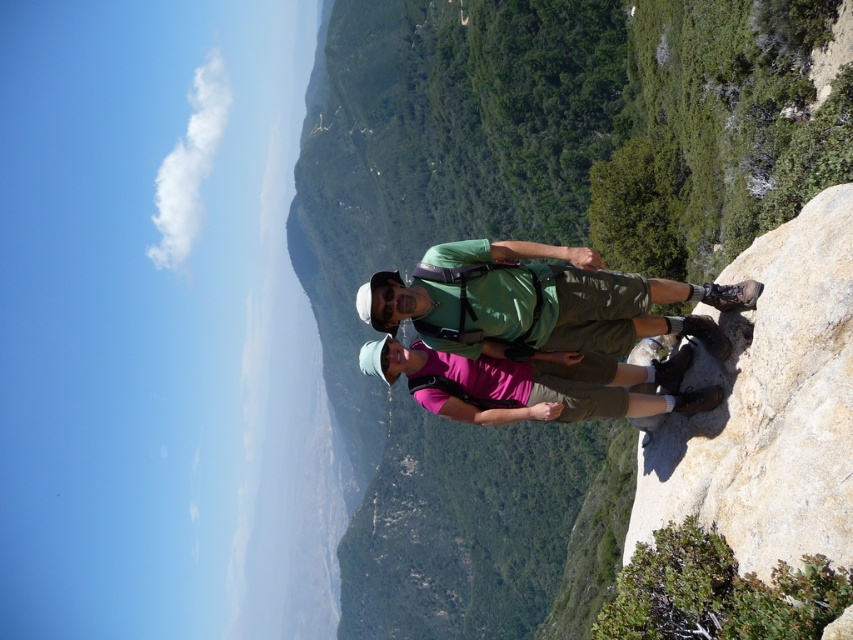
You are planning to take a photo of the green leafy mountain at center from the position of the green matte shirt at center. The camera you have can focus up to 400 meters. Will you be able to capture the mountain clearly?

The distance between the green leafy mountain at center and the green matte shirt at center is 407.06 meters. Since the camera can only focus up to 400 meters, it will not be able to capture the mountain clearly at that distance.

You are a photographer planning to take a photo of the green leafy mountain at center and the pink fabric shirt at center. Since you want both subjects to be in focus, which one should you focus on first to ensure proper depth of field?

You should focus on the pink fabric shirt at center first because it is closer to you than the green leafy mountain at center, which is further away. This way, the depth of field will extend from the shirt to the mountain.